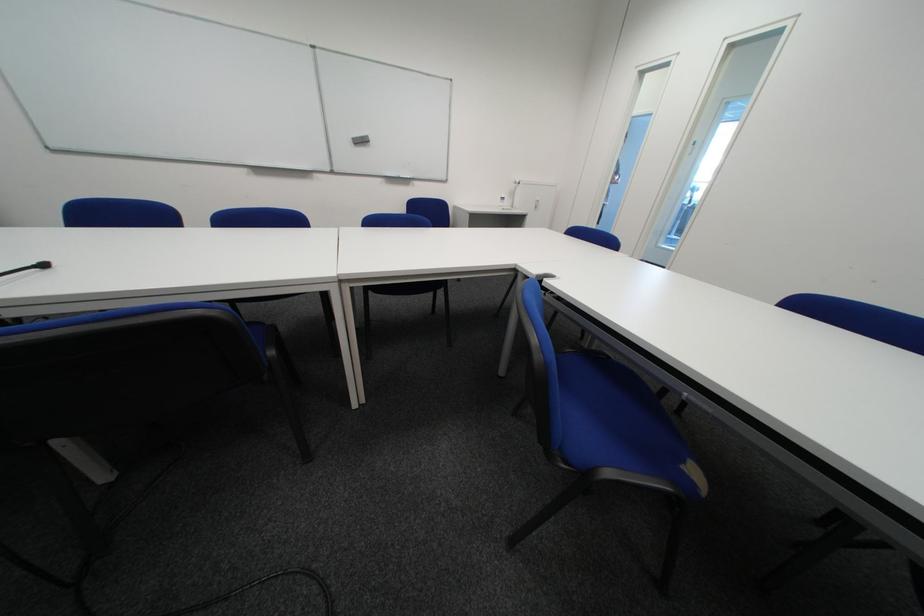
Where is `blue chair sitting surface`? blue chair sitting surface is located at coordinates (600, 411).